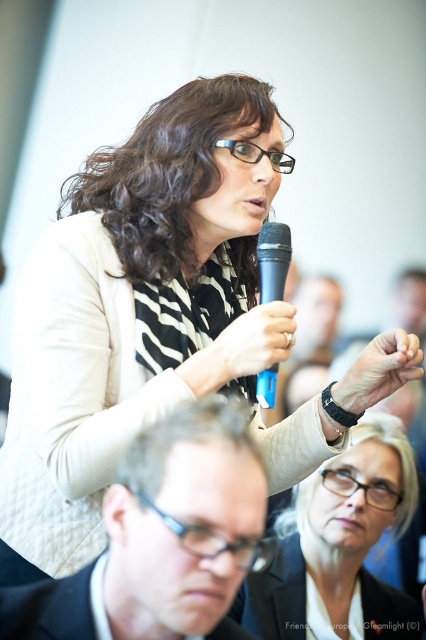
Question: Which point is farther to the camera?

Choices:
 (A) black leather wristwatch at center
 (B) white matte microphone at center

Answer: (A)

Question: Among these points, which one is nearest to the camera?

Choices:
 (A) (276, 225)
 (B) (336, 397)
 (C) (359, 593)

Answer: (A)

Question: Can you confirm if matte black jacket at center is thinner than black leather wristwatch at center?

Choices:
 (A) yes
 (B) no

Answer: (B)

Question: From the image, what is the correct spatial relationship of white matte microphone at center in relation to black leather wristwatch at center?

Choices:
 (A) right
 (B) left

Answer: (B)

Question: Can you confirm if white matte microphone at center is wider than black plastic microphone at center?

Choices:
 (A) yes
 (B) no

Answer: (A)

Question: Which object is closer to the camera taking this photo?

Choices:
 (A) black plastic microphone at center
 (B) matte black jacket at center
 (C) black leather wristwatch at center

Answer: (C)